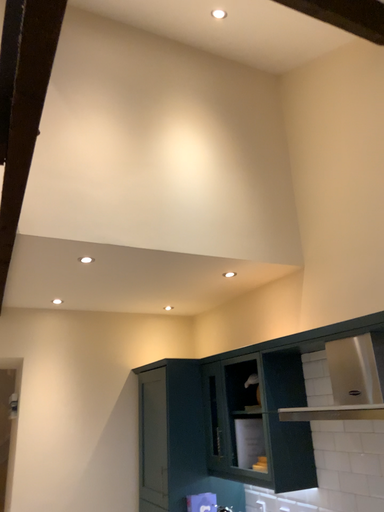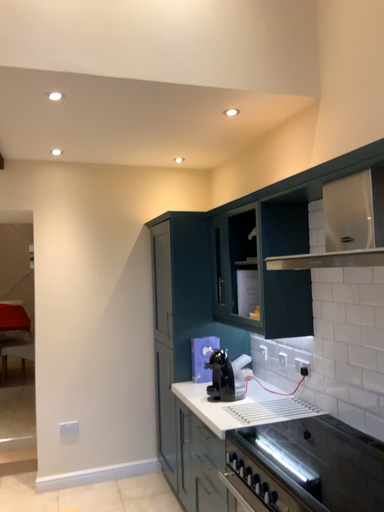
Question: How did the camera likely rotate when shooting the video?

Choices:
 (A) rotated left
 (B) rotated right

Answer: (A)